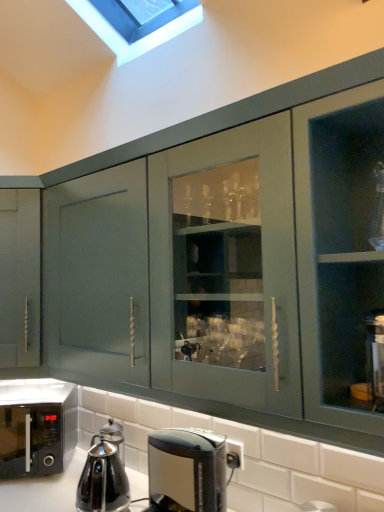
Question: Would you say black glossy coffee maker at lower center is inside or outside black glossy microwave at lower left?

Choices:
 (A) outside
 (B) inside

Answer: (A)

Question: Visually, is black glossy coffee maker at lower center positioned to the left or to the right of black glossy microwave at lower left?

Choices:
 (A) left
 (B) right

Answer: (B)

Question: Based on their relative distances, which object is nearer to the black glossy microwave at lower left?

Choices:
 (A) black glossy coffee maker at lower center
 (B) stainless steel kettle at lower left

Answer: (B)

Question: Based on their relative distances, which object is nearer to the stainless steel kettle at lower left?

Choices:
 (A) black glossy coffee maker at lower center
 (B) black glossy microwave at lower left

Answer: (B)